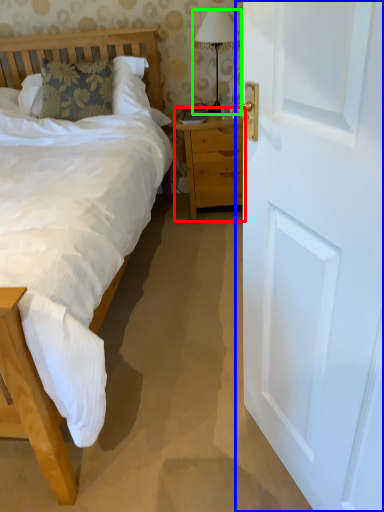
Question: Which object is the closest to the nightstand (highlighted by a red box)? Choose among these: door (highlighted by a blue box) or bedside lamp (highlighted by a green box).

Choices:
 (A) door
 (B) bedside lamp

Answer: (B)